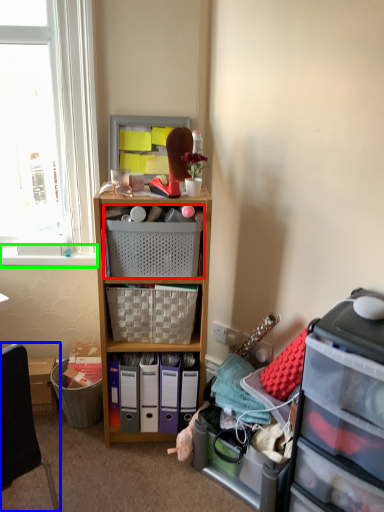
Question: Which is farther away from picnic basket (highlighted by a red box)? chair (highlighted by a blue box) or window sill (highlighted by a green box)?

Choices:
 (A) chair
 (B) window sill

Answer: (A)